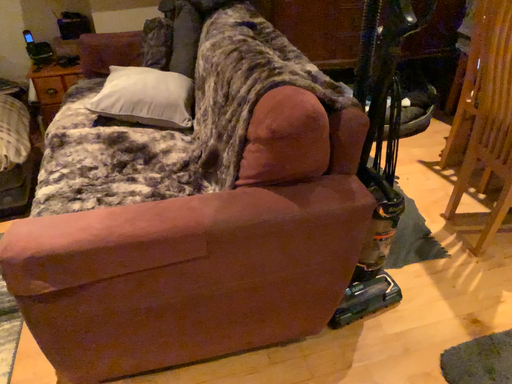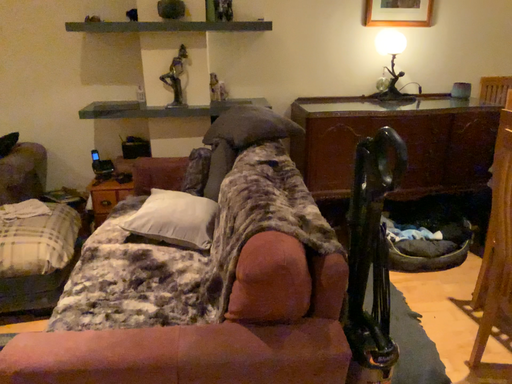
Question: How did the camera likely rotate when shooting the video?

Choices:
 (A) rotated left
 (B) rotated right

Answer: (A)